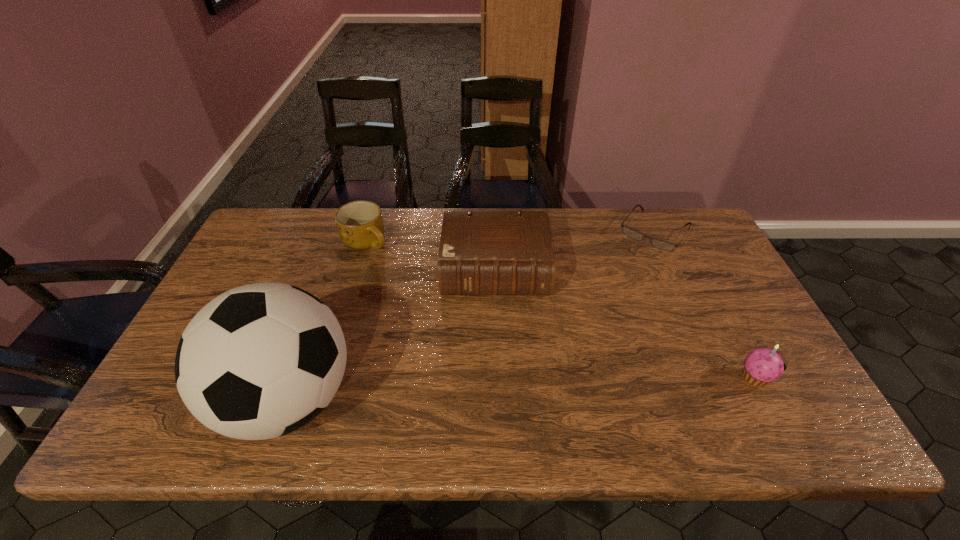
I want to click on vacant spot on the desktop that is between the soccer ball and the cupcake and is positioned on the front-facing side of the shortest object, so click(546, 387).

Locate an element on the screen. This screenshot has height=540, width=960. vacant space on the desktop that is between the soccer ball and the cupcake and is positioned on the side with the handle of the mug is located at coordinates (478, 390).

Where is `free spot on the desktop that is between the tallest object and the cupcake and is positioned on the spine side of the Bible`? This screenshot has height=540, width=960. free spot on the desktop that is between the tallest object and the cupcake and is positioned on the spine side of the Bible is located at coordinates (496, 389).